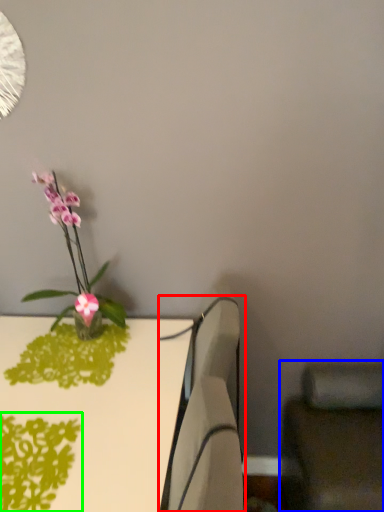
Question: Based on their relative distances, which object is farther from swivel chair (highlighted by a red box)? Choose from swivel chair (highlighted by a blue box) and plant (highlighted by a green box).

Choices:
 (A) swivel chair
 (B) plant

Answer: (A)